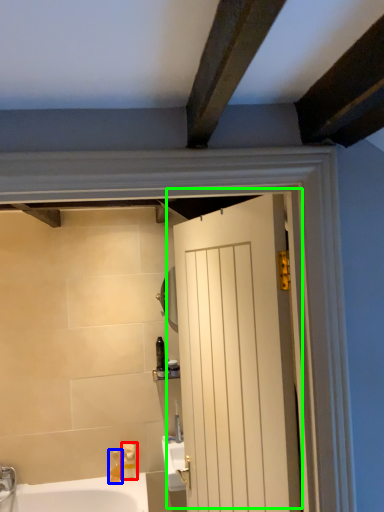
Question: Estimate the real-world distances between objects in this image. Which object is closer to soap dispenser (highlighted by a red box), soap dispenser (highlighted by a blue box) or door (highlighted by a green box)?

Choices:
 (A) soap dispenser
 (B) door

Answer: (A)